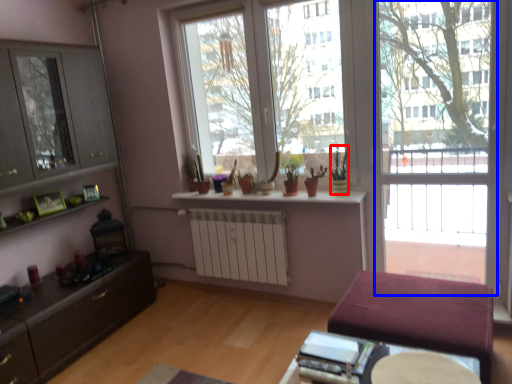
Question: Which of the following is the closest to the observer, houseplant (highlighted by a red box) or screen door (highlighted by a blue box)?

Choices:
 (A) houseplant
 (B) screen door

Answer: (B)